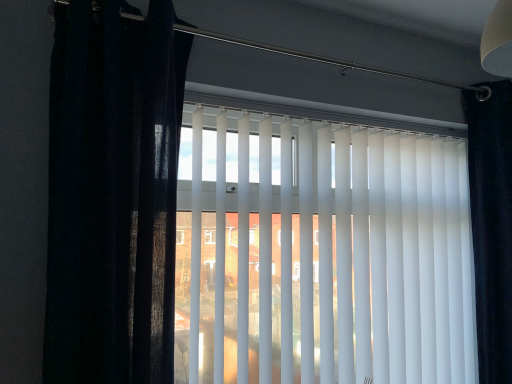
Question: Can you confirm if white matte vertical blinds at center is wider than matte black curtain at left, acting as the second curtain starting from the back?

Choices:
 (A) yes
 (B) no

Answer: (B)

Question: Is white matte vertical blinds at center positioned behind matte black curtain at left, which is the 1th curtain in front-to-back order?

Choices:
 (A) no
 (B) yes

Answer: (B)

Question: Would you say matte black curtain at left, which is the 1th curtain in front-to-back order, is part of white matte vertical blinds at center's contents?

Choices:
 (A) yes
 (B) no

Answer: (B)

Question: Is white matte vertical blinds at center shorter than matte black curtain at left, positioned as the second curtain in right-to-left order?

Choices:
 (A) yes
 (B) no

Answer: (B)

Question: Can you confirm if white matte vertical blinds at center is bigger than matte black curtain at left, which is the 1th curtain in front-to-back order?

Choices:
 (A) no
 (B) yes

Answer: (B)

Question: Is white matte vertical blinds at center outside matte black curtain at left, positioned as the second curtain in right-to-left order?

Choices:
 (A) yes
 (B) no

Answer: (A)

Question: From a real-world perspective, is matte black curtain at left, which is the 1th curtain in front-to-back order, below black velvet curtain at right, acting as the second curtain starting from the left?

Choices:
 (A) yes
 (B) no

Answer: (B)

Question: From a real-world perspective, is matte black curtain at left, which is the 1th curtain in front-to-back order, located higher than black velvet curtain at right, the 1th curtain from the back?

Choices:
 (A) no
 (B) yes

Answer: (B)

Question: From the image's perspective, is matte black curtain at left, acting as the second curtain starting from the back, located above black velvet curtain at right, acting as the second curtain starting from the left?

Choices:
 (A) no
 (B) yes

Answer: (B)

Question: Is black velvet curtain at right, acting as the second curtain starting from the left, surrounded by matte black curtain at left, acting as the second curtain starting from the back?

Choices:
 (A) no
 (B) yes

Answer: (A)

Question: Considering the relative sizes of matte black curtain at left, marked as the first curtain in a left-to-right arrangement, and black velvet curtain at right, positioned as the first curtain in right-to-left order, in the image provided, is matte black curtain at left, marked as the first curtain in a left-to-right arrangement, taller than black velvet curtain at right, positioned as the first curtain in right-to-left order,?

Choices:
 (A) yes
 (B) no

Answer: (B)

Question: Is matte black curtain at left, positioned as the second curtain in right-to-left order, turned away from black velvet curtain at right, the 1th curtain from the back?

Choices:
 (A) no
 (B) yes

Answer: (A)

Question: Is black velvet curtain at right, acting as the second curtain starting from the left, smaller than matte black curtain at left, which is the 1th curtain in front-to-back order?

Choices:
 (A) yes
 (B) no

Answer: (A)